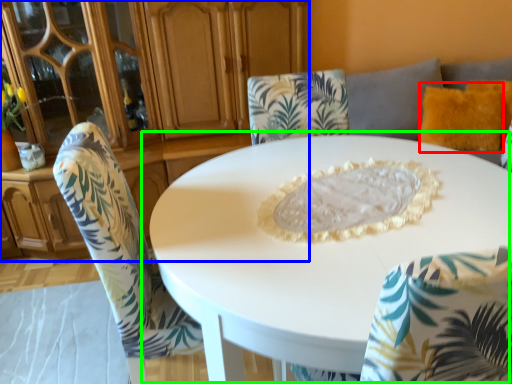
Question: Which is nearer to the pillow (highlighted by a red box)? dresser (highlighted by a blue box) or table (highlighted by a green box).

Choices:
 (A) dresser
 (B) table

Answer: (B)